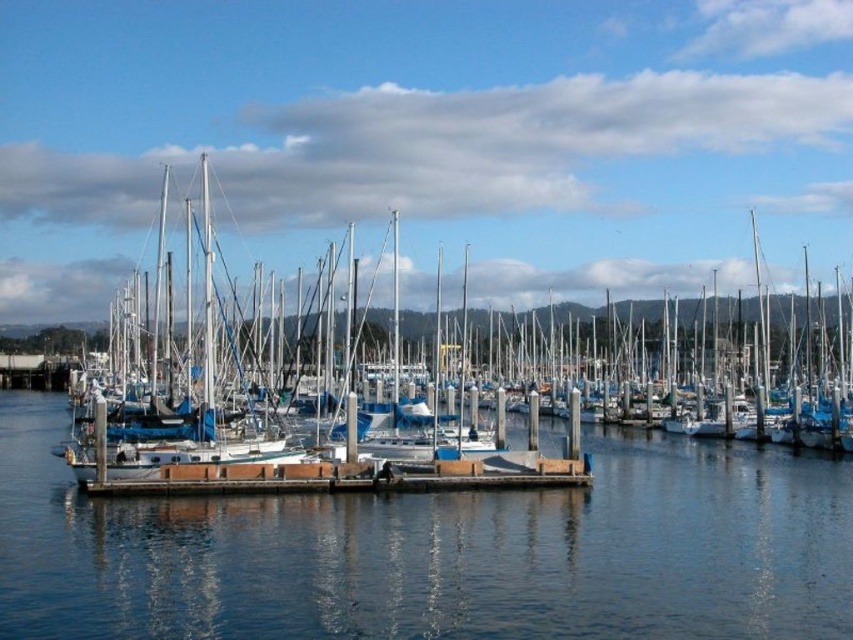
Question: Can you confirm if white matte sailboat at center is wider than brown wooden dock at center?

Choices:
 (A) no
 (B) yes

Answer: (B)

Question: Does clear water at center have a smaller size compared to brown wooden dock at center?

Choices:
 (A) no
 (B) yes

Answer: (A)

Question: Does clear water at center appear over white matte sailboat at center?

Choices:
 (A) no
 (B) yes

Answer: (A)

Question: Which point appears farthest from the camera in this image?

Choices:
 (A) (397, 385)
 (B) (239, 588)
 (C) (579, 460)

Answer: (A)

Question: Which of these objects is positioned farthest from the white matte sailboat at center?

Choices:
 (A) brown wooden dock at center
 (B) clear water at center

Answer: (A)

Question: Which point is closer to the camera?

Choices:
 (A) white matte sailboat at center
 (B) clear water at center

Answer: (B)